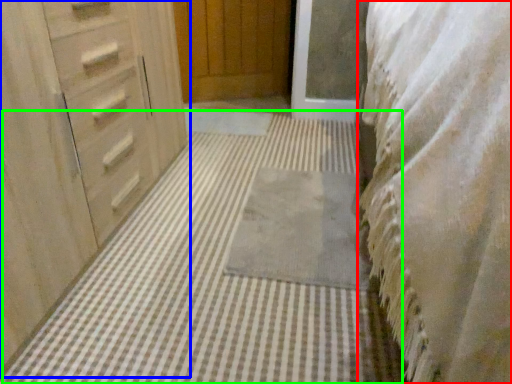
Question: Which object is the closest to the bedding (highlighted by a red box)? Choose among these: chest of drawers (highlighted by a blue box) or bath mat (highlighted by a green box).

Choices:
 (A) chest of drawers
 (B) bath mat

Answer: (B)